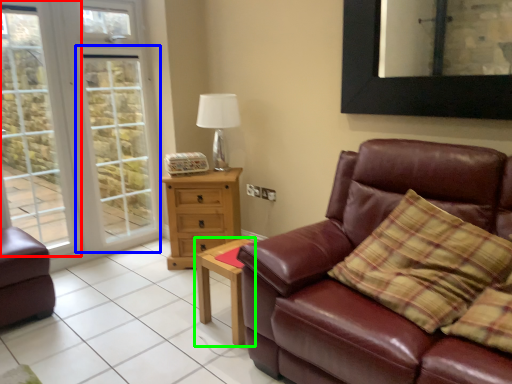
Question: Which object is the farthest from window (highlighted by a red box)? Choose among these: screen door (highlighted by a blue box) or table (highlighted by a green box).

Choices:
 (A) screen door
 (B) table

Answer: (B)